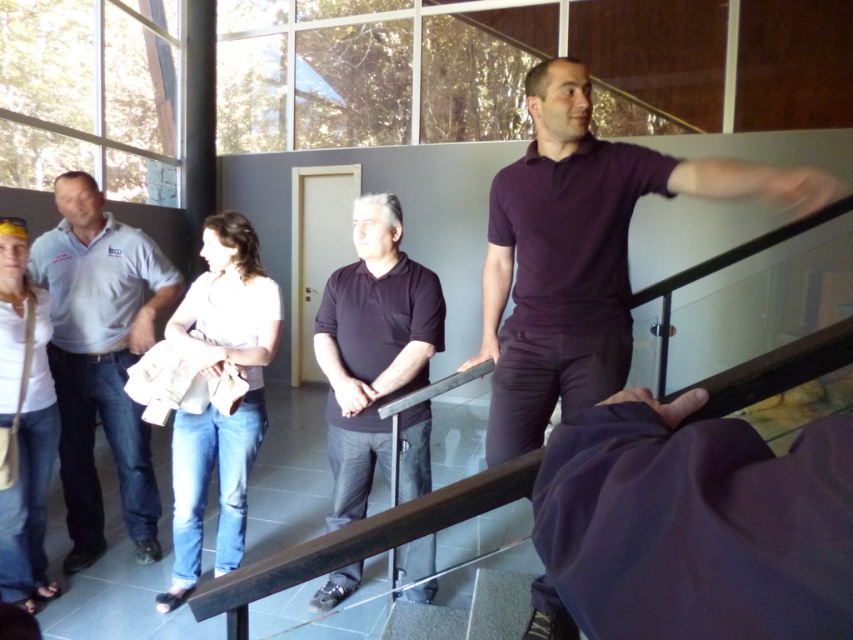
Question: Is purple matte shirt at upper right thinner than dark matte polo shirt at center?

Choices:
 (A) no
 (B) yes

Answer: (A)

Question: Which point is farther to the camera?

Choices:
 (A) light pink fabric shirt at center
 (B) light blue denim jeans at left

Answer: (B)

Question: Which object appears closest to the camera in this image?

Choices:
 (A) black metal/rail at center
 (B) purple matte shirt at upper right
 (C) dark matte polo shirt at center

Answer: (B)

Question: Which object appears farthest from the camera in this image?

Choices:
 (A) light blue denim jeans at left
 (B) light pink fabric shirt at center
 (C) white matte shirt at lower left

Answer: (A)

Question: Is the position of purple matte shirt at upper right less distant than that of white matte shirt at lower left?

Choices:
 (A) yes
 (B) no

Answer: (A)

Question: Can you confirm if light blue denim jeans at left is thinner than white matte shirt at lower left?

Choices:
 (A) no
 (B) yes

Answer: (A)